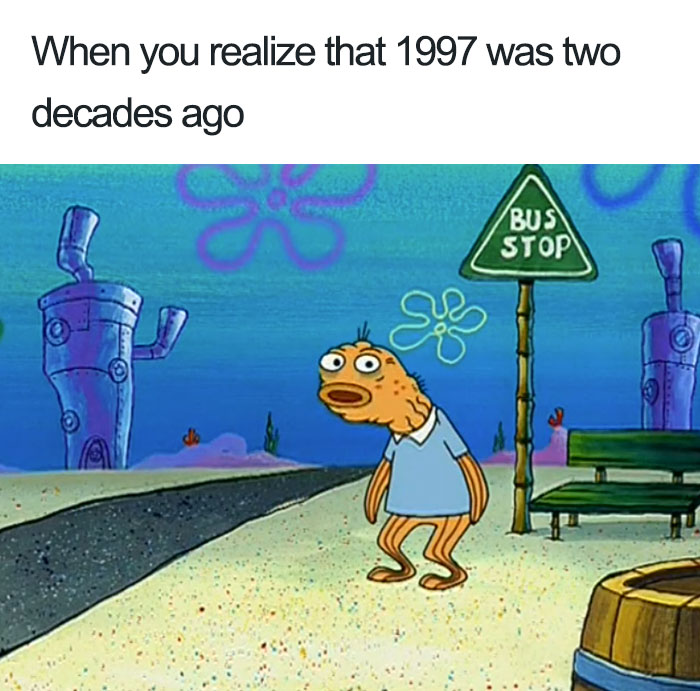
This screenshot has height=691, width=700. Find the location of `wood grain`. wood grain is located at coordinates (650, 631), (662, 647), (631, 645).